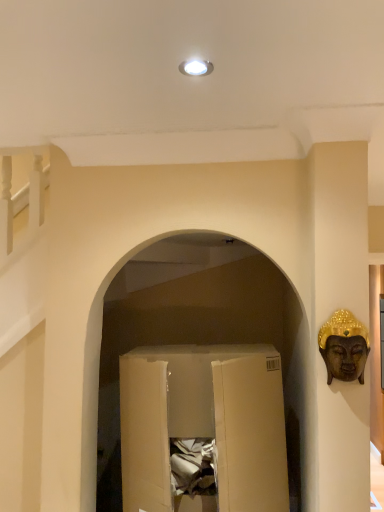
Question: Is gold textured buddha head at right to the left or to the right of cardboard box at center in the image?

Choices:
 (A) left
 (B) right

Answer: (B)

Question: Considering the positions of gold textured buddha head at right and cardboard box at center in the image, is gold textured buddha head at right wider or thinner than cardboard box at center?

Choices:
 (A) wide
 (B) thin

Answer: (B)

Question: Is point (339, 309) positioned closer to the camera than point (192, 403)?

Choices:
 (A) closer
 (B) farther

Answer: (A)

Question: Based on their sizes in the image, would you say cardboard box at center is bigger or smaller than gold textured buddha head at right?

Choices:
 (A) small
 (B) big

Answer: (B)

Question: From a real-world perspective, is cardboard box at center above or below gold textured buddha head at right?

Choices:
 (A) above
 (B) below

Answer: (B)

Question: Based on their positions, is cardboard box at center located to the left or right of gold textured buddha head at right?

Choices:
 (A) right
 (B) left

Answer: (B)

Question: From the image's perspective, is cardboard box at center located above or below gold textured buddha head at right?

Choices:
 (A) above
 (B) below

Answer: (B)